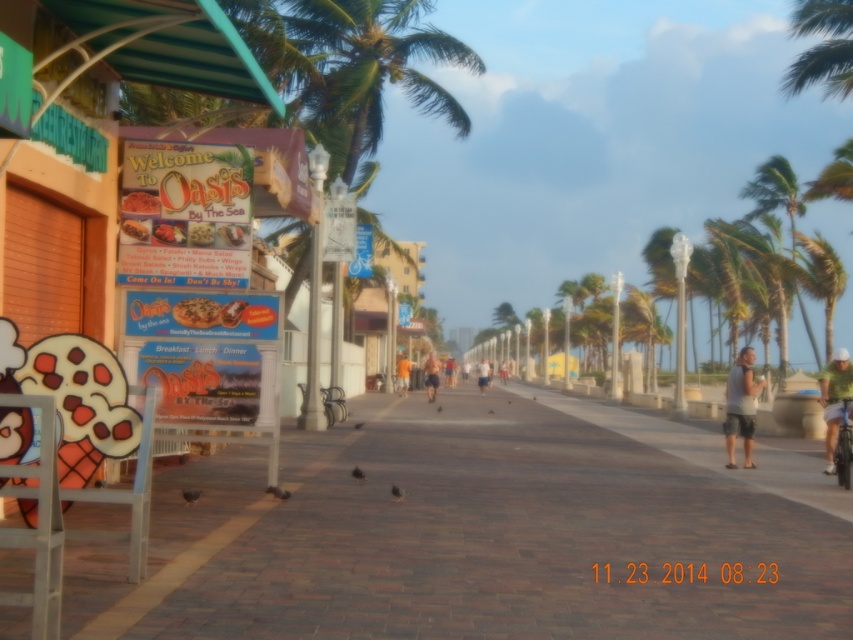
Does gray matte tank top at right have a larger size compared to orange fabric shorts at center?

No.

Does gray matte tank top at right have a smaller size compared to orange fabric shorts at center?

Yes, gray matte tank top at right is smaller than orange fabric shorts at center.

Image resolution: width=853 pixels, height=640 pixels. I want to click on gray matte tank top at right, so click(x=741, y=406).

Is green leafy palm tree at upper right to the right of green leafy palm tree at right from the viewer's perspective?

In fact, green leafy palm tree at upper right is to the left of green leafy palm tree at right.

Is point (795, 292) in front of point (828, 253)?

No, it is behind (828, 253).

Is point (785, 168) more distant than point (805, 289)?

Yes, it is.

The height and width of the screenshot is (640, 853). I want to click on green leafy palm tree at upper right, so click(775, 192).

Between green leafy palm tree at right and green fabric shirt at right, which one is positioned lower?

green fabric shirt at right

From the picture: Is green leafy palm tree at right wider than green fabric shirt at right?

Yes, green leafy palm tree at right is wider than green fabric shirt at right.

Between point (817, 289) and point (834, 468), which one is positioned behind?

The point (817, 289) is more distant.

I want to click on green leafy palm tree at right, so click(821, 278).